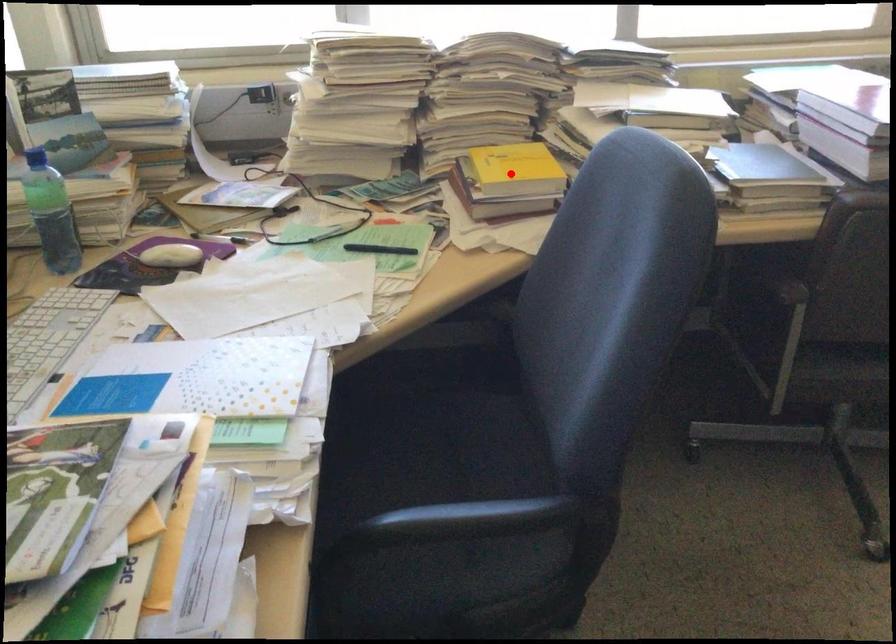
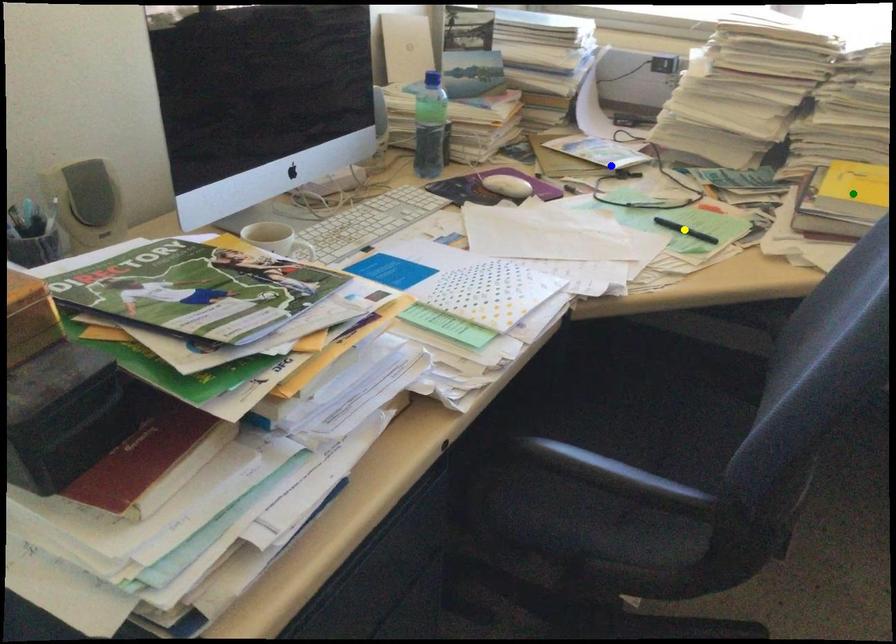
Question: I am providing you with two images of the same scene from different viewpoints. A red point is marked on the first image. You are given multiple points on the second image. Which spot in image 2 lines up with the point in image 1?

Choices:
 (A) yellow point
 (B) green point
 (C) blue point

Answer: (B)